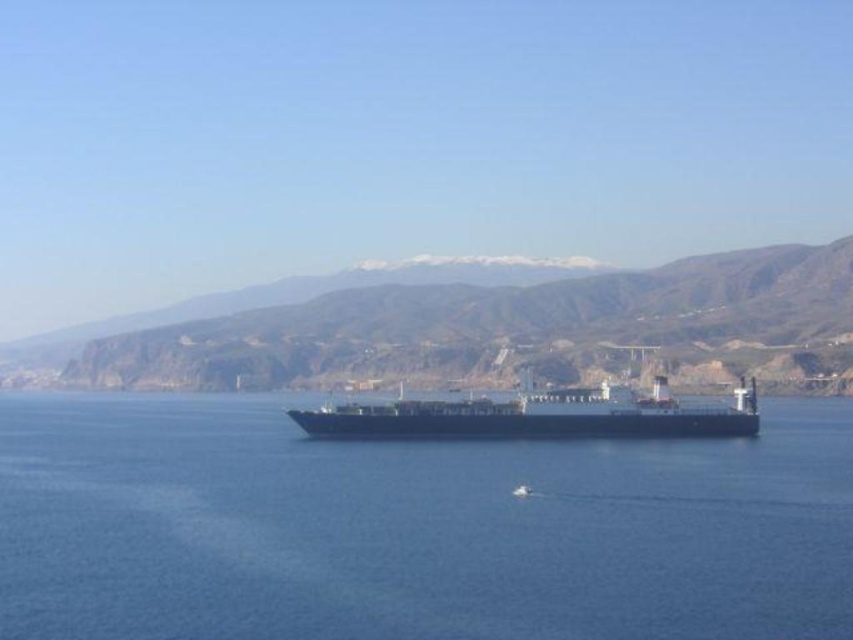
Does blue water at center have a lesser height compared to brown rocky mountain at center?

Yes.

Is blue water at center closer to camera compared to brown rocky mountain at center?

Yes, it is in front of brown rocky mountain at center.

What do you see at coordinates (412, 529) in the screenshot? I see `blue water at center` at bounding box center [412, 529].

Locate an element on the screen. This screenshot has height=640, width=853. blue water at center is located at coordinates (412, 529).

Is blue water at center to the right of black matte cargo ship at center from the viewer's perspective?

Indeed, blue water at center is positioned on the right side of black matte cargo ship at center.

Locate an element on the screen. blue water at center is located at coordinates (412, 529).

Does brown rocky mountain at center have a greater width compared to black matte cargo ship at center?

Yes, brown rocky mountain at center is wider than black matte cargo ship at center.

Measure the distance between point [555,300] and camera.

They are 608.11 meters apart.

Image resolution: width=853 pixels, height=640 pixels. Find the location of `brown rocky mountain at center`. brown rocky mountain at center is located at coordinates (496, 332).

Find the location of a particular element. brown rocky mountain at center is located at coordinates (496, 332).